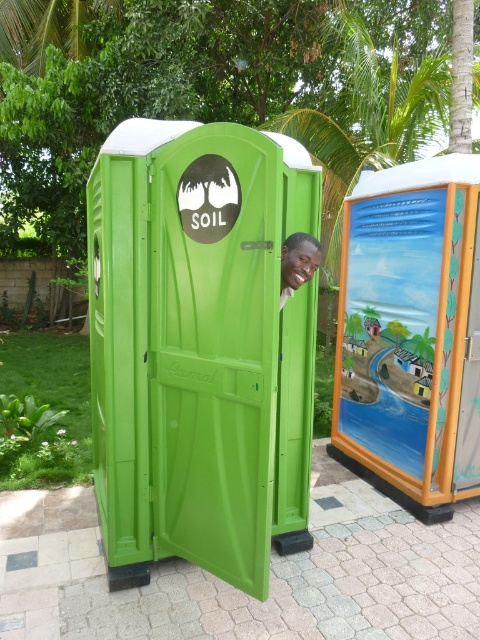
Does green plastic porta-potty at center appear over smooth green door at center?

No, green plastic porta-potty at center is not above smooth green door at center.

Which is behind, point (301, 228) or point (305, 280)?

Point (301, 228)

Identify the location of green plastic porta-potty at center. (200, 348).